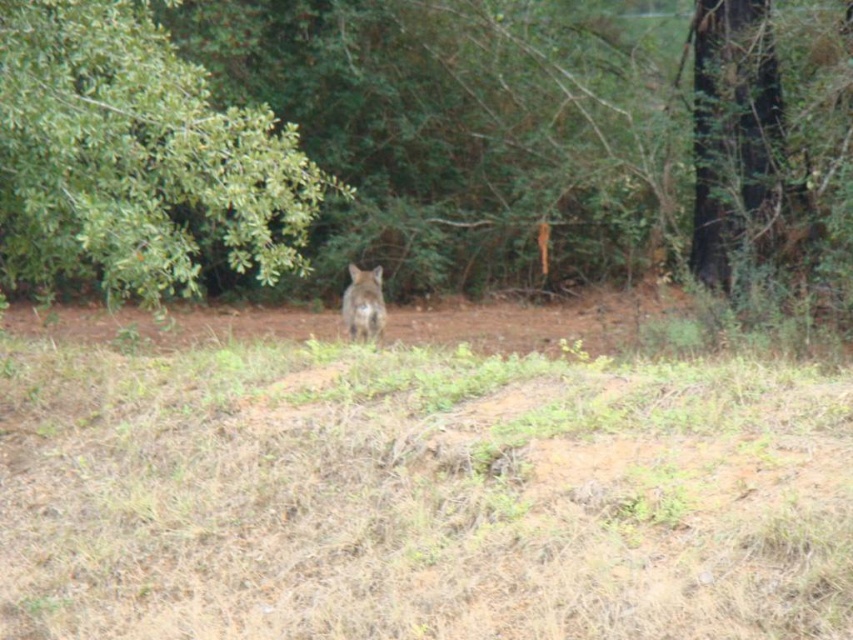
You are an animal tracker trying to determine the best path to approach the brown fur at center without being noticed. Considering the green leafy tree at upper left, which object would provide better cover for your approach?

The green leafy tree at upper left provides better cover because its width is larger than the brown fur at center, offering a wider area to hide behind during the approach.

You are an animal tracker observing the scene. The green leafy tree at upper left and the brown fur at center are both visible in your field of view. Which object is nearer to you?

The green leafy tree at upper left is closer to the viewer than the brown fur at center, so the green leafy tree at upper left is nearer to you.

You are navigating through a forest and see the green leafy tree at upper left. Based on its position, can you determine if it is closer to the camera or further away compared to the dense foliage in the background?

The green leafy tree at upper left is located at point (136, 160), which places it in the upper left corner of the image. Since the background is described as having lush green areas, the tree is likely closer to the camera than the dense foliage in the background.